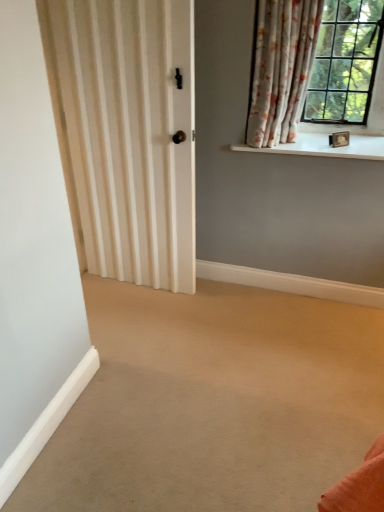
Question: Considering the positions of white smooth window sill at upper right and floral fabric curtain at upper right in the image, is white smooth window sill at upper right taller or shorter than floral fabric curtain at upper right?

Choices:
 (A) tall
 (B) short

Answer: (B)

Question: Is point (369, 136) positioned closer to the camera than point (299, 98)?

Choices:
 (A) farther
 (B) closer

Answer: (B)

Question: Based on their sizes in the image, would you say white smooth window sill at upper right is bigger or smaller than floral fabric curtain at upper right?

Choices:
 (A) small
 (B) big

Answer: (A)

Question: Relative to white smooth window sill at upper right, is floral fabric curtain at upper right in front or behind?

Choices:
 (A) front
 (B) behind

Answer: (A)

Question: Considering the positions of floral fabric curtain at upper right and white smooth window sill at upper right in the image, is floral fabric curtain at upper right wider or thinner than white smooth window sill at upper right?

Choices:
 (A) wide
 (B) thin

Answer: (B)

Question: From the image's perspective, relative to white smooth window sill at upper right, is floral fabric curtain at upper right above or below?

Choices:
 (A) above
 (B) below

Answer: (A)

Question: From a real-world perspective, is floral fabric curtain at upper right positioned above or below white smooth window sill at upper right?

Choices:
 (A) below
 (B) above

Answer: (B)